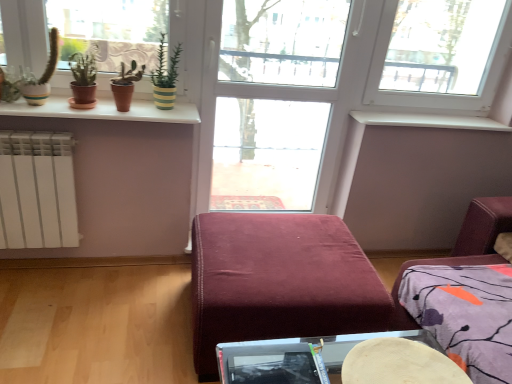
Where is `vacant space situated above wooden round table at lower center (from a real-world perspective)`? The height and width of the screenshot is (384, 512). vacant space situated above wooden round table at lower center (from a real-world perspective) is located at coordinates (400, 362).